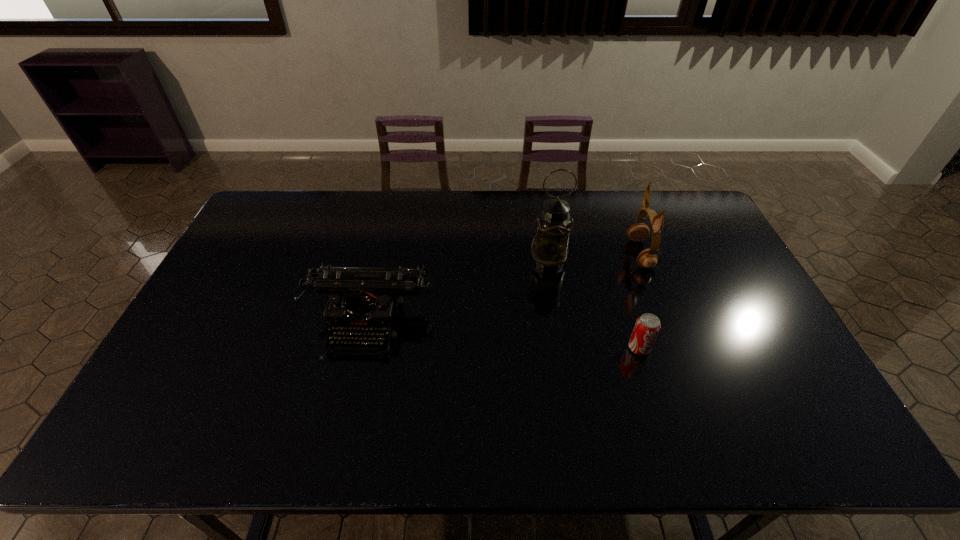
Where is `oil lamp`? oil lamp is located at coordinates point(550,246).

Locate an element on the screen. This screenshot has height=540, width=960. the tallest object is located at coordinates (550, 246).

Locate an element on the screen. The image size is (960, 540). earphone is located at coordinates (648, 258).

Identify the location of the second tallest object. This screenshot has height=540, width=960. (648, 258).

Where is `the second shortest object`? The height and width of the screenshot is (540, 960). the second shortest object is located at coordinates (365, 302).

Locate an element on the screen. the leftmost object is located at coordinates point(365,302).

The height and width of the screenshot is (540, 960). I want to click on the second object from right to left, so click(x=647, y=327).

Where is `the shortest object`? the shortest object is located at coordinates (647, 327).

The width and height of the screenshot is (960, 540). Find the location of `vacant area located on the right of the second object from left to right`. vacant area located on the right of the second object from left to right is located at coordinates (675, 262).

The width and height of the screenshot is (960, 540). What are the coordinates of `vacant space located on the front-facing side of the earphone` in the screenshot? It's located at (593, 254).